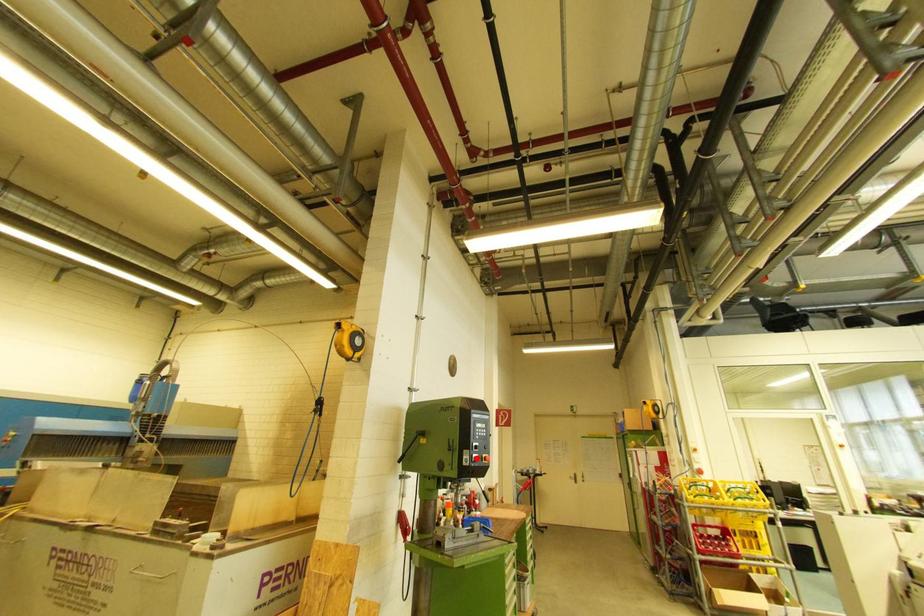
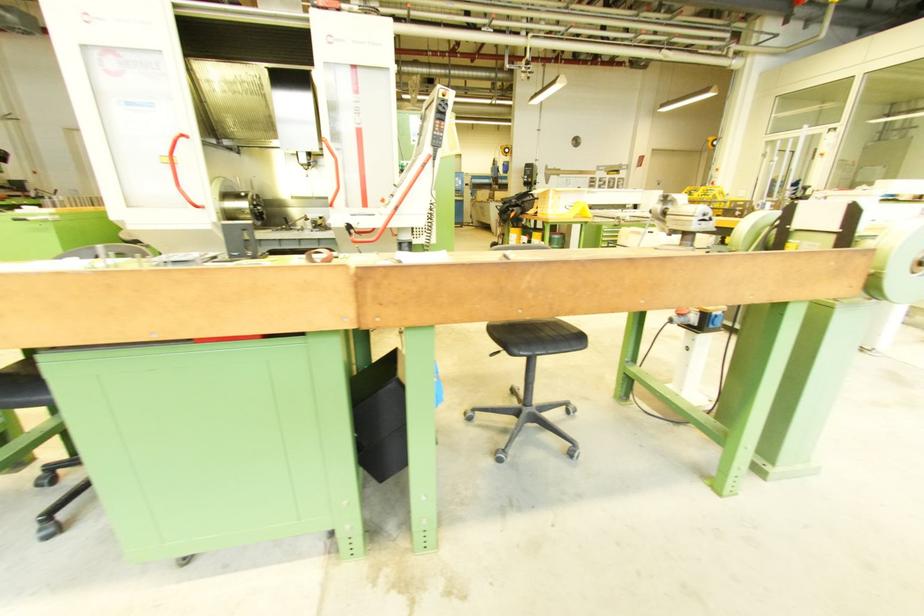
Question: I am providing you with two images of the same scene from different viewpoints. A red point is marked on the first image. At the location where the point appears in image 1, is it still visible in image 2?

Choices:
 (A) Yes
 (B) No

Answer: (B)